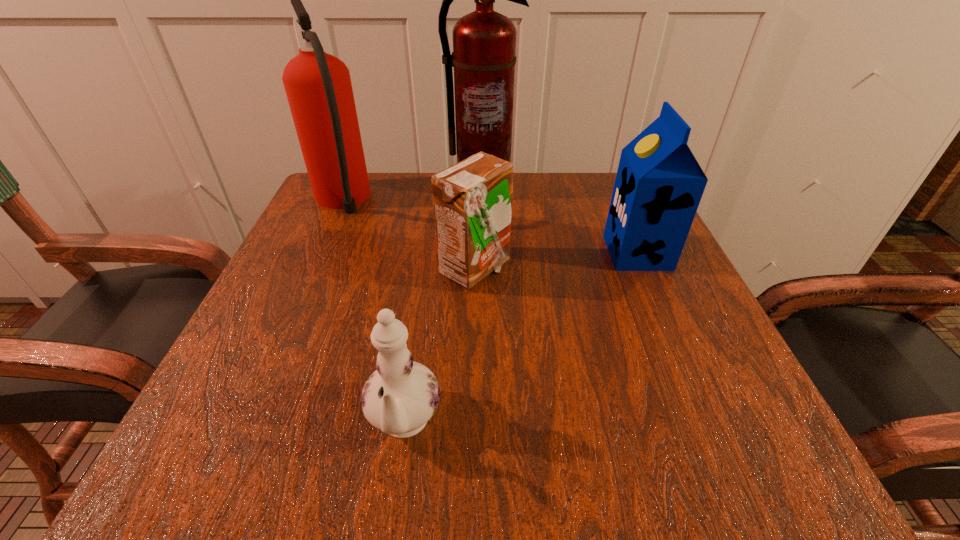
Where is `vacant region located on the straw side of the left carton`? vacant region located on the straw side of the left carton is located at coordinates (579, 269).

Where is `object located in the near edge section of the desktop`? This screenshot has height=540, width=960. object located in the near edge section of the desktop is located at coordinates pyautogui.click(x=399, y=398).

Find the location of a particular element. Image resolution: width=960 pixels, height=540 pixels. object located in the left edge section of the desktop is located at coordinates click(318, 86).

Where is `object at the right edge`? object at the right edge is located at coordinates (659, 184).

This screenshot has height=540, width=960. Find the location of `object positioned at the far left corner`. object positioned at the far left corner is located at coordinates (318, 86).

This screenshot has width=960, height=540. In the image, there is a desktop. In order to click on vacant space at the far edge in this screenshot , I will do `click(396, 207)`.

Find the location of `vacant space at the near edge of the desktop`. vacant space at the near edge of the desktop is located at coordinates (x=325, y=461).

In order to click on vacant space at the left edge of the desktop in this screenshot , I will do point(250,377).

The image size is (960, 540). What are the coordinates of `vacant area at the right edge` in the screenshot? It's located at (633, 366).

Find the location of a particular element. vacant region at the far left corner of the desktop is located at coordinates (376, 225).